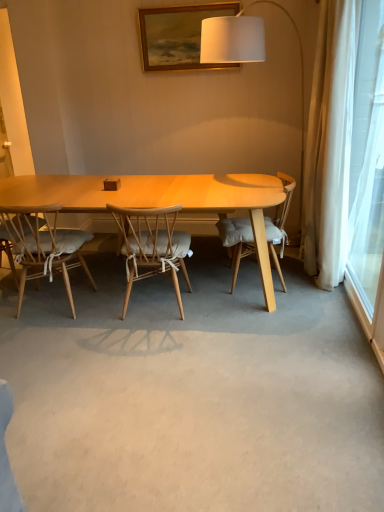
Question: Is transparent glass window at right to the left or to the right of white fabric lampshade at upper center in the image?

Choices:
 (A) right
 (B) left

Answer: (A)

Question: Which is correct: transparent glass window at right is inside white fabric lampshade at upper center, or outside of it?

Choices:
 (A) inside
 (B) outside

Answer: (B)

Question: Estimate the real-world distances between objects in this image. Which object is closer to the light wood chair with cushion at center, the 3th chair in the left-to-right sequence?

Choices:
 (A) white fabric lampshade at upper center
 (B) light wood chair with white cushion at left, acting as the third chair starting from the right
 (C) transparent glass window at right
 (D) wooden picture frame at upper center
 (E) natural wood chair with cushion at center, which is the 2th chair from right to left

Answer: (A)

Question: Estimate the real-world distances between objects in this image. Which object is farther from the wooden picture frame at upper center?

Choices:
 (A) light wood chair with cushion at center, the 1th chair positioned from the right
 (B) white fabric lampshade at upper center
 (C) natural wood chair with cushion at center, which is the 2th chair from right to left
 (D) transparent glass window at right
 (E) light wood chair with white cushion at left, which is the first chair in left-to-right order

Answer: (E)